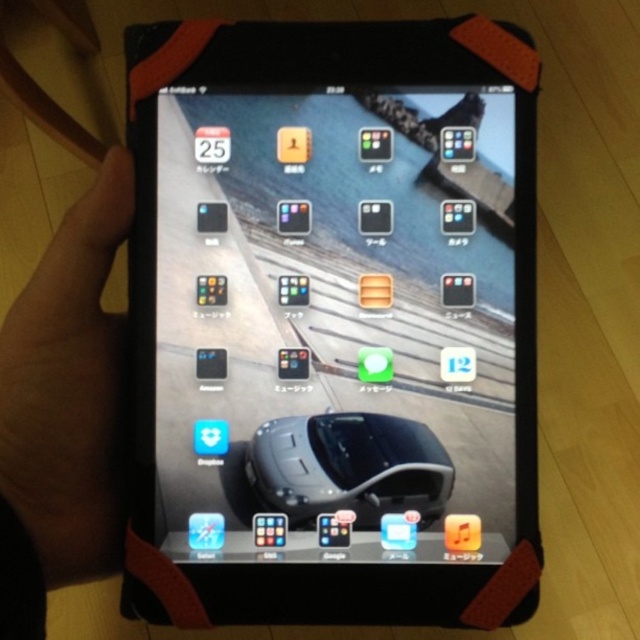
From the picture: You are holding a tablet with a protective case and looking at the home screen. There is a point at coordinates (451,177) on the tablet screen. If you want to touch this point with your finger, will your finger be closer to the tablet screen or further away compared to the calendar app icon at the top left corner?

The point at (451,177) is 21.03 inches from the viewer. Since the calendar app icon at the top left corner is part of the tablet screen, it is also at the same distance from the viewer as the screen itself. Therefore, touching the point would require your finger to be at the same distance as the calendar app icon, so neither closer nor further away.